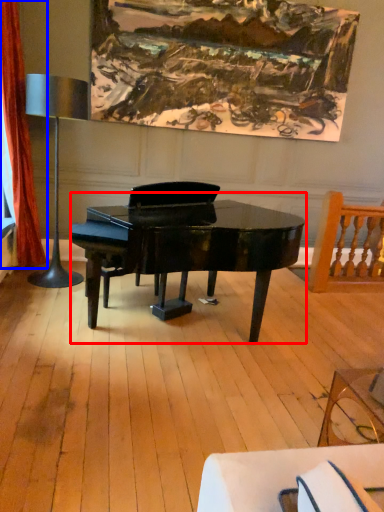
Question: Among these objects, which one is nearest to the camera, piano (highlighted by a red box) or curtain (highlighted by a blue box)?

Choices:
 (A) piano
 (B) curtain

Answer: (A)